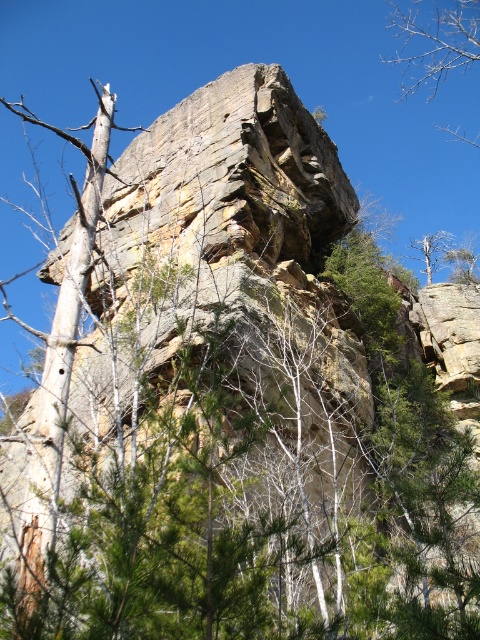
Consider the image. Can you confirm if bare branches at upper right is shorter than dead wood tree at upper right?

Incorrect, bare branches at upper right's height does not fall short of dead wood tree at upper right's.

Is bare branches at upper right smaller than dead wood tree at upper right?

No, bare branches at upper right is not smaller than dead wood tree at upper right.

What are the coordinates of `bare branches at upper right` in the screenshot? It's located at (434, 44).